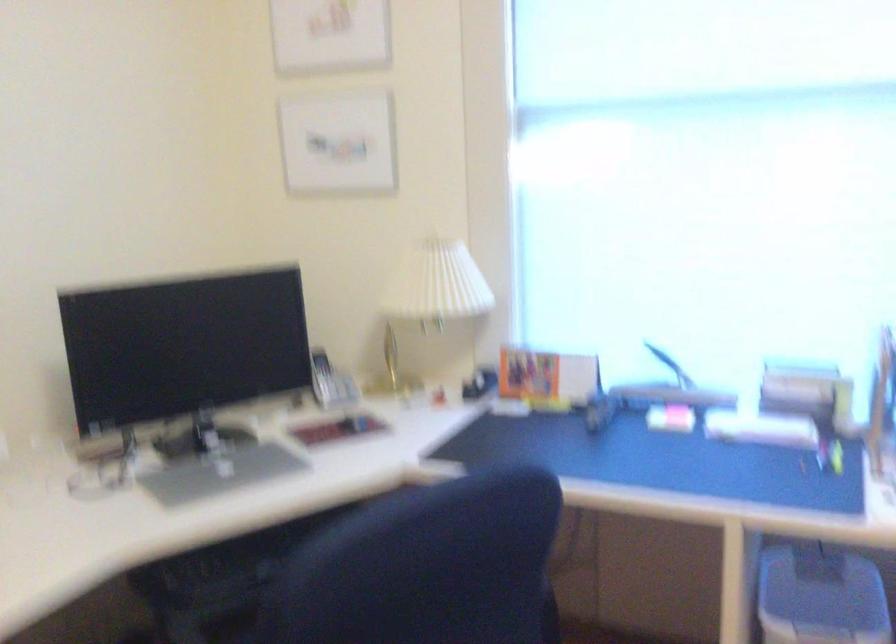
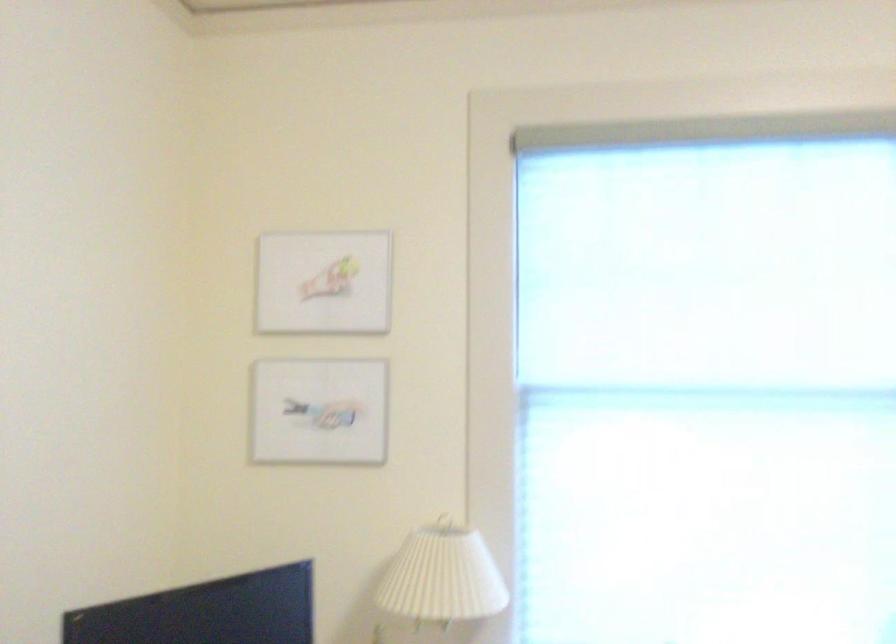
Locate, in the second image, the point that corresponds to (423,279) in the first image.

(443, 576)